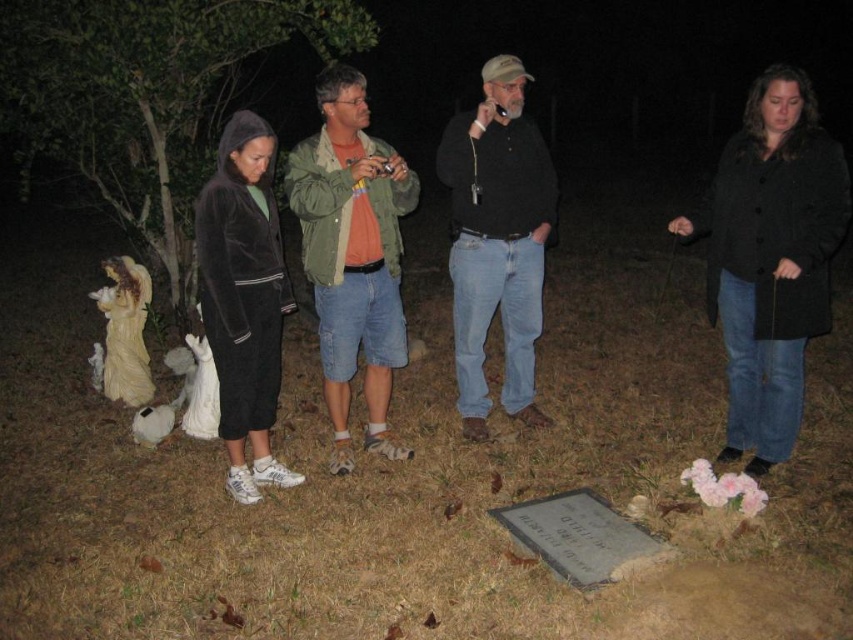
You are a photographer standing near the black wool coat at right and the black matte shirt at center. You want to take a photo of both subjects without any obstruction. Given that your camera has a maximum focus range of 4 feet, will you be able to capture both subjects in focus?

The distance between the black wool coat at right and the black matte shirt at center is 3.87 feet, which is within the camera maximum focus range of 4 feet. So yes, you can capture both subjects in focus.